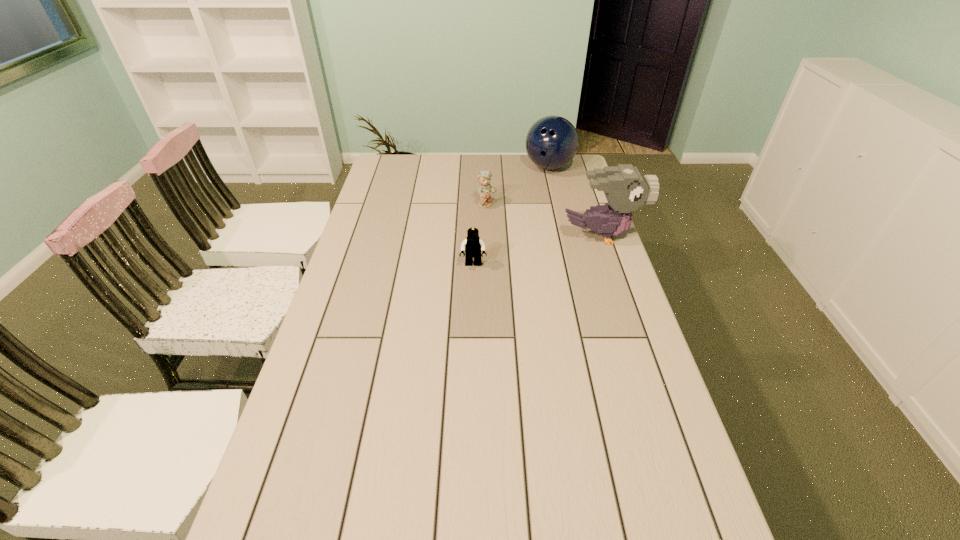
You are a GUI agent. You are given a task and a screenshot of the screen. Output one action in this format:
    pyautogui.click(x=<x>, y=<y>)
    Task: Click on the free space on the desktop that is between the Lego and the bird and is positioned on the front-facing side of the third nearest object
    This screenshot has width=960, height=540.
    Given the screenshot: What is the action you would take?
    pyautogui.click(x=556, y=246)

The height and width of the screenshot is (540, 960). In order to click on vacant space on the desktop that is between the nearest object and the second nearest object and is positioned on the surface of the farthest object near the finger holes in this screenshot , I will do `click(546, 248)`.